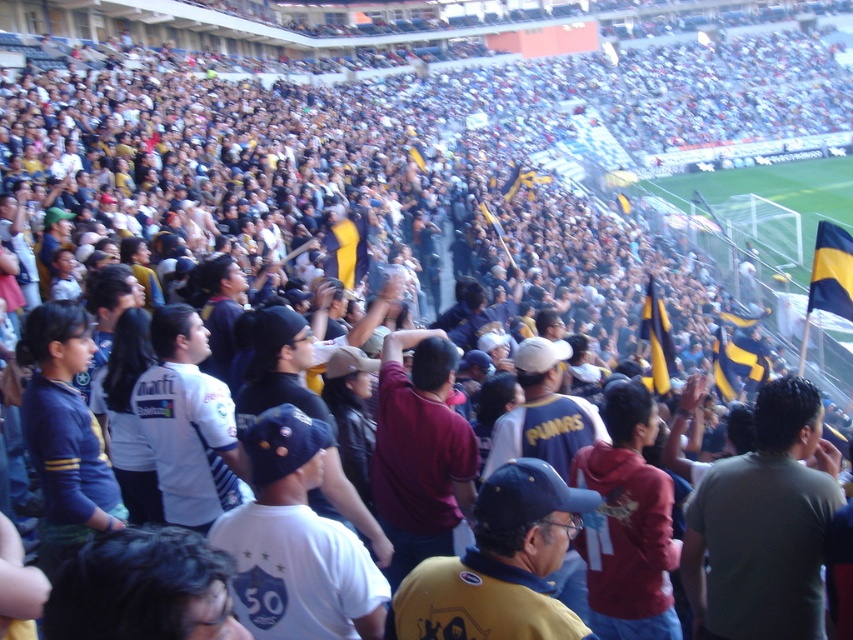
Is yellowmaterial/textureflag at center-right to the left of yellow fabric flag at center from the viewer's perspective?

No, yellowmaterial/textureflag at center-right is not to the left of yellow fabric flag at center.

In the scene shown: Between yellowmaterial/textureflag at center-right and yellow fabric flag at center, which one has more height?

yellowmaterial/textureflag at center-right

Is point (659, 301) farther from viewer compared to point (347, 269)?

No, it is not.

At what (x,y) coordinates should I click in order to perform the action: click on yellowmaterial/textureflag at center-right. Please return your answer as a coordinate pair (x, y). Looking at the image, I should click on (657, 339).

Is yellowmaterial/textureflag at right positioned in front of yellowmaterial/textureflag at center-right?

Yes, it is.

Is yellowmaterial/textureflag at right wider than yellowmaterial/textureflag at center-right?

Indeed, yellowmaterial/textureflag at right has a greater width compared to yellowmaterial/textureflag at center-right.

At what (x,y) coordinates should I click in order to perform the action: click on yellowmaterial/textureflag at right. Please return your answer as a coordinate pair (x, y). The width and height of the screenshot is (853, 640). Looking at the image, I should click on (831, 272).

Where is `yellowmaterial/textureflag at right`? This screenshot has height=640, width=853. yellowmaterial/textureflag at right is located at coordinates (831, 272).

Does yellowmaterial/textureflag at right have a greater height compared to yellow fabric flag at center?

Yes, yellowmaterial/textureflag at right is taller than yellow fabric flag at center.

Can you confirm if yellowmaterial/textureflag at right is shorter than yellow fabric flag at center?

Incorrect, yellowmaterial/textureflag at right's height does not fall short of yellow fabric flag at center's.

From the picture: Who is more distant from viewer, (843, 276) or (354, 260)?

The point (354, 260) is behind.

I want to click on yellowmaterial/textureflag at right, so click(831, 272).